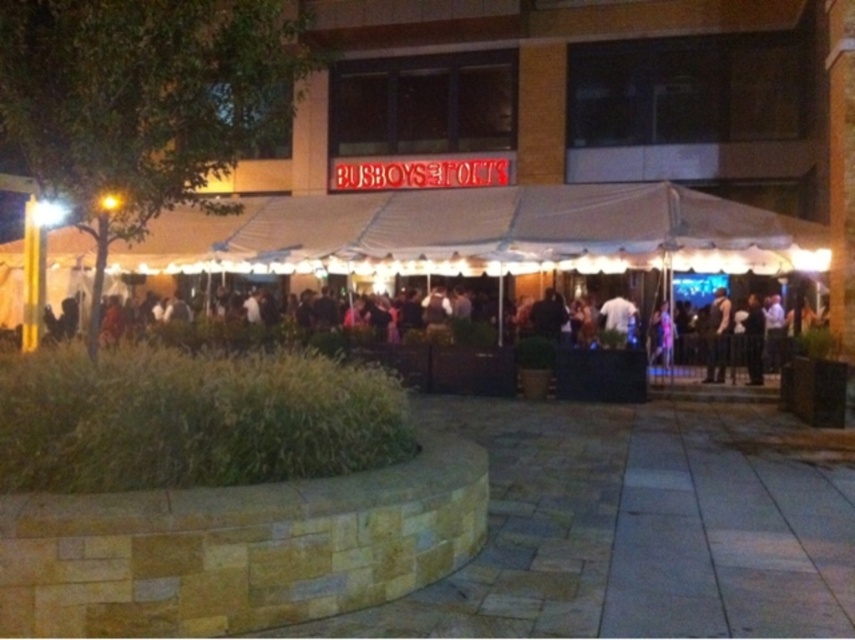
Does white tent at center appear under black fabric tent at center?

No, white tent at center is not below black fabric tent at center.

Is point (292, 244) farther from viewer compared to point (624, 372)?

Yes, it is behind point (624, 372).

Identify the location of white tent at center. (482, 234).

Can you confirm if black fabric tent at center is positioned above dark brown leather jacket at center?

Yes, black fabric tent at center is above dark brown leather jacket at center.

Is black fabric tent at center below dark brown leather jacket at center?

No, black fabric tent at center is not below dark brown leather jacket at center.

Describe the element at coordinates (370, 352) in the screenshot. The width and height of the screenshot is (855, 640). I see `black fabric tent at center` at that location.

At what (x,y) coordinates should I click in order to perform the action: click on black fabric tent at center. Please return your answer as a coordinate pair (x, y). Looking at the image, I should click on (370, 352).

Between white tent at center and dark brown leather jacket at center, which one appears on the right side from the viewer's perspective?

Positioned to the right is dark brown leather jacket at center.

From the picture: Does white tent at center have a lesser height compared to dark brown leather jacket at center?

No, white tent at center is not shorter than dark brown leather jacket at center.

This screenshot has height=640, width=855. I want to click on white tent at center, so click(482, 234).